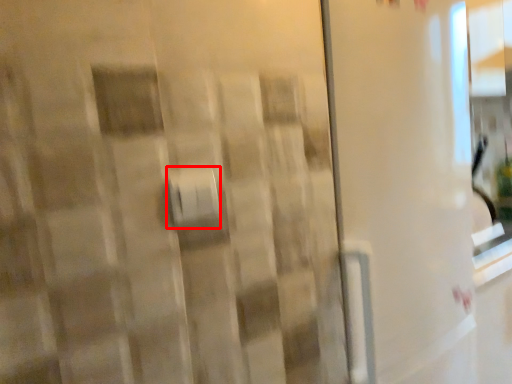
Question: From the image's perspective, considering the relative positions of towel bar (annotated by the red box) and screen door in the image provided, where is towel bar (annotated by the red box) located with respect to the staircase?

Choices:
 (A) above
 (B) below

Answer: (A)